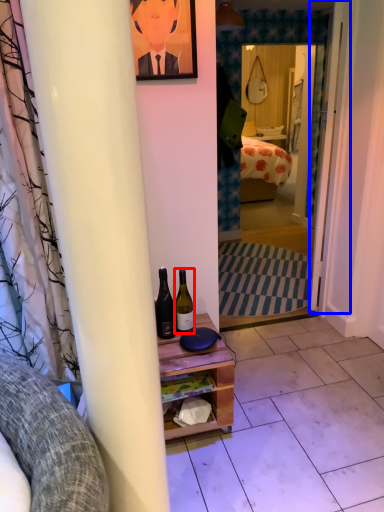
Question: Which point is closer to the camera, bottle (highlighted by a red box) or door (highlighted by a blue box)?

Choices:
 (A) bottle
 (B) door

Answer: (A)